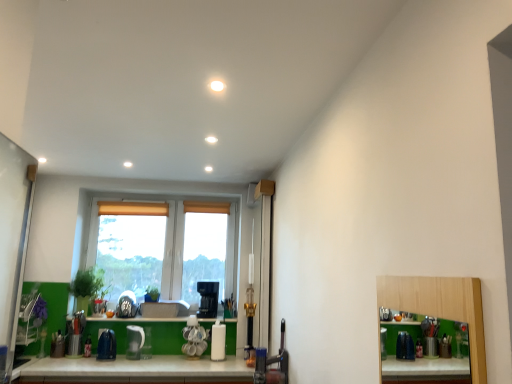
Question: Is green matte plant at left, the 2th plant positioned from the right, shorter than white glossy kettle at center, placed as the second appliance when sorted from right to left?

Choices:
 (A) no
 (B) yes

Answer: (A)

Question: From a real-world perspective, is green matte plant at left, the 2th plant positioned from the right, physically below white glossy kettle at center, placed as the second appliance when sorted from right to left?

Choices:
 (A) no
 (B) yes

Answer: (A)

Question: From the image's perspective, does green matte plant at left, acting as the 1th plant starting from the left, appear lower than white glossy kettle at center, placed as the second appliance when sorted from right to left?

Choices:
 (A) no
 (B) yes

Answer: (A)

Question: Does green matte plant at left, the 2th plant positioned from the right, lie in front of white glossy kettle at center, placed as the second appliance when sorted from right to left?

Choices:
 (A) yes
 (B) no

Answer: (B)

Question: Considering the relative positions of green matte plant at left, acting as the 1th plant starting from the left, and white glossy kettle at center, placed as the 2th appliance when sorted from left to right, in the image provided, is green matte plant at left, acting as the 1th plant starting from the left, to the left of white glossy kettle at center, placed as the 2th appliance when sorted from left to right, from the viewer's perspective?

Choices:
 (A) no
 (B) yes

Answer: (B)

Question: Based on their positions, is white glossy coffee maker at center, placed as the 3th appliance when sorted from left to right, located to the left or right of green matte window sill at lower center?

Choices:
 (A) left
 (B) right

Answer: (B)

Question: From a real-world perspective, relative to green matte window sill at lower center, is white glossy coffee maker at center, which appears as the first appliance when viewed from the right, vertically above or below?

Choices:
 (A) above
 (B) below

Answer: (B)

Question: Is point (195, 339) positioned closer to the camera than point (108, 317)?

Choices:
 (A) farther
 (B) closer

Answer: (B)

Question: Is white glossy coffee maker at center, placed as the 3th appliance when sorted from left to right, taller or shorter than green matte window sill at lower center?

Choices:
 (A) tall
 (B) short

Answer: (A)

Question: Relative to blue plastic kettle at lower center, the third appliance positioned from the right, is black plastic coffee machine at center in front or behind?

Choices:
 (A) front
 (B) behind

Answer: (B)

Question: In terms of width, does black plastic coffee machine at center look wider or thinner when compared to blue plastic kettle at lower center, the third appliance positioned from the right?

Choices:
 (A) thin
 (B) wide

Answer: (B)

Question: Is black plastic coffee machine at center to the left or to the right of blue plastic kettle at lower center, placed as the 1th appliance when sorted from left to right, in the image?

Choices:
 (A) right
 (B) left

Answer: (A)

Question: From a real-world perspective, is black plastic coffee machine at center positioned above or below blue plastic kettle at lower center, placed as the 1th appliance when sorted from left to right?

Choices:
 (A) below
 (B) above

Answer: (B)

Question: Is white glossy kettle at center, placed as the second appliance when sorted from right to left, bigger or smaller than white glossy coffee maker at center, which appears as the first appliance when viewed from the right?

Choices:
 (A) big
 (B) small

Answer: (A)

Question: Is white glossy kettle at center, placed as the second appliance when sorted from right to left, inside or outside of white glossy coffee maker at center, placed as the 3th appliance when sorted from left to right?

Choices:
 (A) outside
 (B) inside

Answer: (A)